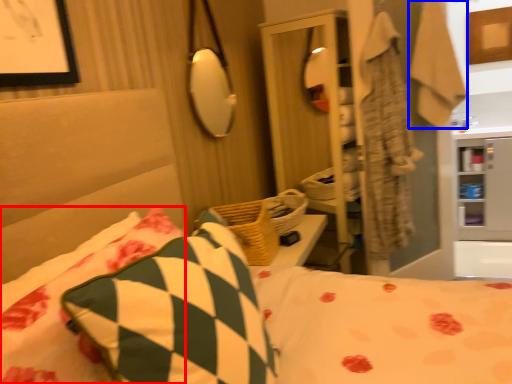
Question: Which of the following is the farthest to the observer, pillow (highlighted by a red box) or robe (highlighted by a blue box)?

Choices:
 (A) pillow
 (B) robe

Answer: (B)